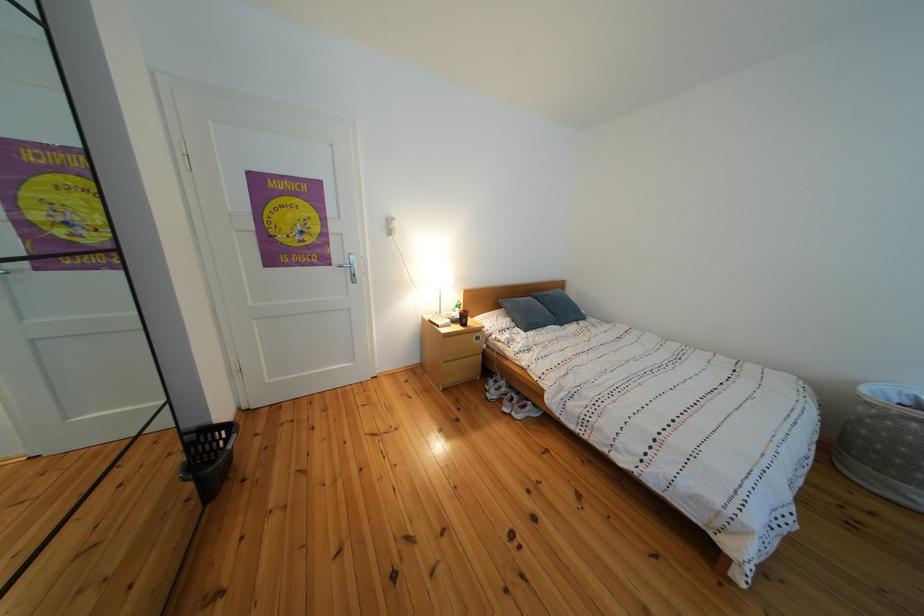
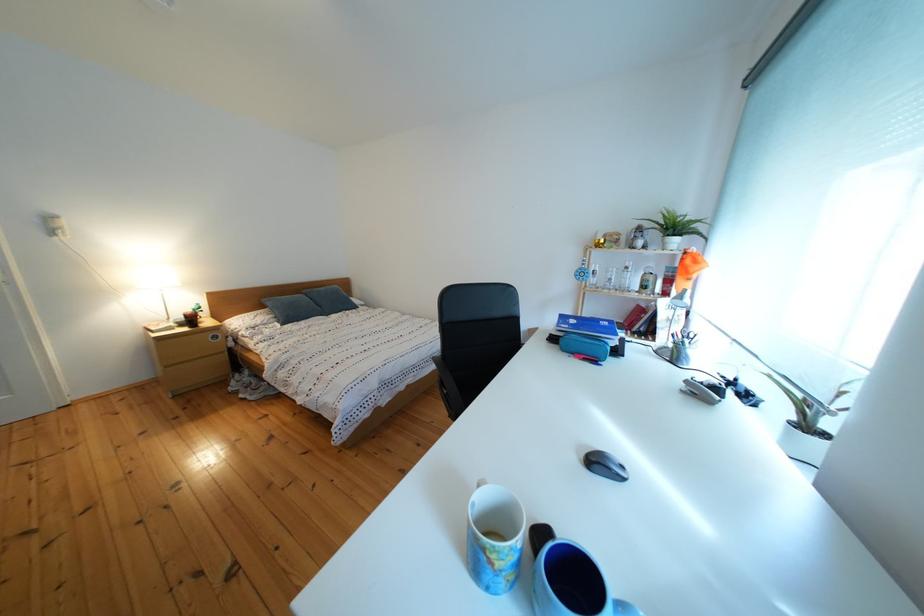
The images are taken continuously from a first-person perspective. In which direction are you moving?

The movement direction of the cameraman is right, backward.